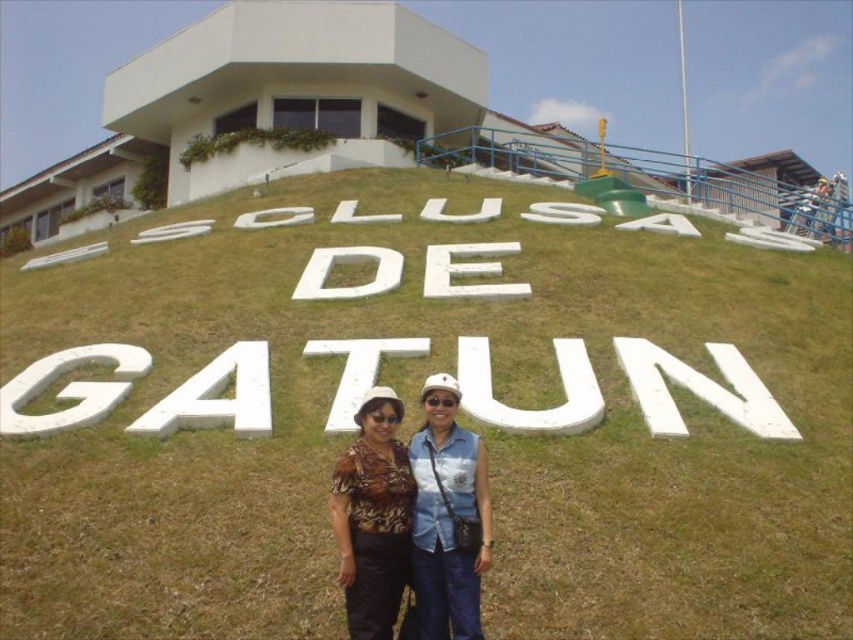
Does green grassy at center have a lesser width compared to printed fabric shirt at center?

No.

Is green grassy at center above printed fabric shirt at center?

Yes.

The width and height of the screenshot is (853, 640). Find the location of `green grassy at center`. green grassy at center is located at coordinates (415, 424).